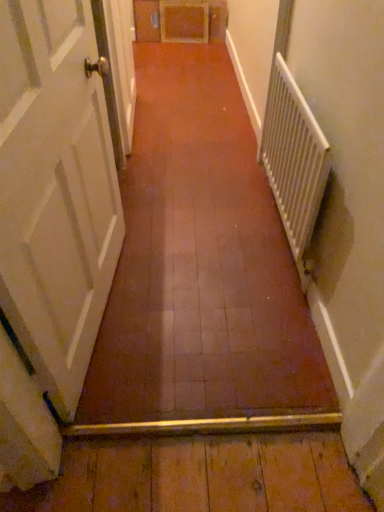
In order to face white painted wood door at left, should I rotate leftwards or rightwards?

To align with it, rotate left about 15.422°.

Image resolution: width=384 pixels, height=512 pixels. Identify the location of white painted wood door at left. (55, 190).

The image size is (384, 512). What do you see at coordinates (55, 190) in the screenshot?
I see `white painted wood door at left` at bounding box center [55, 190].

This screenshot has height=512, width=384. What are the coordinates of `white metallic radiator at right` in the screenshot? It's located at (294, 158).

Measure the distance between white metallic radiator at right and camera.

The distance of white metallic radiator at right from camera is 1.32 meters.

This screenshot has width=384, height=512. Describe the element at coordinates (294, 158) in the screenshot. I see `white metallic radiator at right` at that location.

What is the approximate width of white metallic radiator at right?

white metallic radiator at right is 7.68 centimeters wide.

Where is `white painted wood door at left`? Image resolution: width=384 pixels, height=512 pixels. white painted wood door at left is located at coordinates (55, 190).

Is white metallic radiator at right at the right side of white painted wood door at left?

Yes, white metallic radiator at right is to the right of white painted wood door at left.

Considering their positions, is white metallic radiator at right located in front of or behind white painted wood door at left?

white metallic radiator at right is positioned farther from the viewer than white painted wood door at left.

Which is behind, point (288, 135) or point (52, 139)?

The point (288, 135) is farther from the camera.

From the image's perspective, which object appears higher, white metallic radiator at right or white painted wood door at left?

white metallic radiator at right, from the image's perspective.

From a real-world perspective, is white metallic radiator at right on top of white painted wood door at left?

No, from a real-world perspective, white metallic radiator at right is not on top of white painted wood door at left.

Between white metallic radiator at right and white painted wood door at left, which one has smaller width?

With smaller width is white metallic radiator at right.

Between white metallic radiator at right and white painted wood door at left, which one has more height?

white painted wood door at left.

Is white metallic radiator at right bigger than white painted wood door at left?

Actually, white metallic radiator at right might be smaller than white painted wood door at left.

Is white painted wood door at left surrounded by white metallic radiator at right?

No.

Is white metallic radiator at right positioned far away from white painted wood door at left?

white metallic radiator at right is actually quite close to white painted wood door at left.

Is white metallic radiator at right positioned with its back to white painted wood door at left?

No.

In the scene shown: How many degrees apart are the facing directions of white metallic radiator at right and white painted wood door at left?

The angular difference between white metallic radiator at right and white painted wood door at left is 172 degrees.

At what (x,y) coordinates should I click in order to perform the action: click on door located below the white metallic radiator at right (from the image's perspective). Please return your answer as a coordinate pair (x, y). Looking at the image, I should click on (55, 190).

Considering the positions of objects white painted wood door at left and white metallic radiator at right in the image provided, who is more to the left, white painted wood door at left or white metallic radiator at right?

Positioned to the left is white painted wood door at left.

Which is in front, white painted wood door at left or white metallic radiator at right?

white painted wood door at left.

Is point (64, 24) closer or farther from the camera than point (305, 134)?

Point (64, 24) is closer to the camera than point (305, 134).

From the image's perspective, is white painted wood door at left positioned above or below white metallic radiator at right?

Based on their image positions, white painted wood door at left is located beneath white metallic radiator at right.

From a real-world perspective, does white painted wood door at left stand above white metallic radiator at right?

Yes, from a real-world perspective, white painted wood door at left is over white metallic radiator at right

Which of these two, white painted wood door at left or white metallic radiator at right, is wider?

Wider between the two is white painted wood door at left.

Considering the relative sizes of white painted wood door at left and white metallic radiator at right in the image provided, is white painted wood door at left taller than white metallic radiator at right?

Yes.

Considering the sizes of objects white painted wood door at left and white metallic radiator at right in the image provided, who is smaller, white painted wood door at left or white metallic radiator at right?

Smaller between the two is white metallic radiator at right.

Choose the correct answer: Is white painted wood door at left inside white metallic radiator at right or outside it?

white painted wood door at left lies outside white metallic radiator at right.

Are white painted wood door at left and white metallic radiator at right beside each other?

No, white painted wood door at left is not next to white metallic radiator at right.

Is white metallic radiator at right at the back of white painted wood door at left?

white painted wood door at left does not have its back to white metallic radiator at right.

At what (x,y) coordinates should I click in order to perform the action: click on door on the left side of white metallic radiator at right. Please return your answer as a coordinate pair (x, y). The height and width of the screenshot is (512, 384). Looking at the image, I should click on (55, 190).

Locate an element on the screen. radiator behind the white painted wood door at left is located at coordinates (294, 158).

This screenshot has height=512, width=384. Find the location of `door above the white metallic radiator at right (from a real-world perspective)`. door above the white metallic radiator at right (from a real-world perspective) is located at coordinates (55, 190).